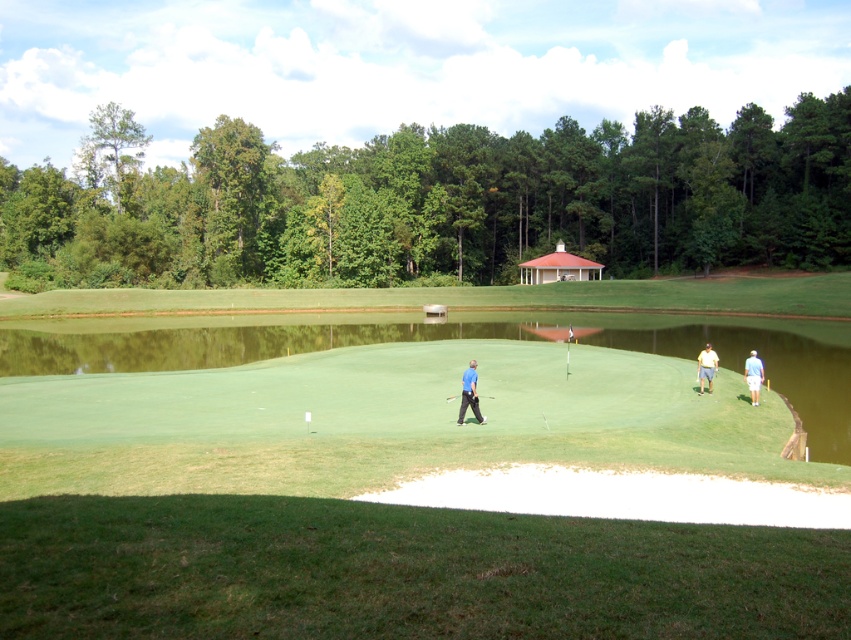
You are standing at the center of the golf course and see the yellow cotton shirt at right. If you want to walk directly towards it, in which general direction should you move? Please answer using the 2D coordinates provided in the scene description.

The yellow cotton shirt at right is located at coordinates point (706, 365). Since you are at the center, moving towards the right side of the image would align with the direction of the shirt.

You are standing on the golf course and see two points marked on the ground. The first point is at coordinates point (x=149, y=408) and the second is at point (x=473, y=406). Which point is closer to you?

Point (x=149, y=408) is closer to you because it is further to the viewer than point (x=473, y=406).